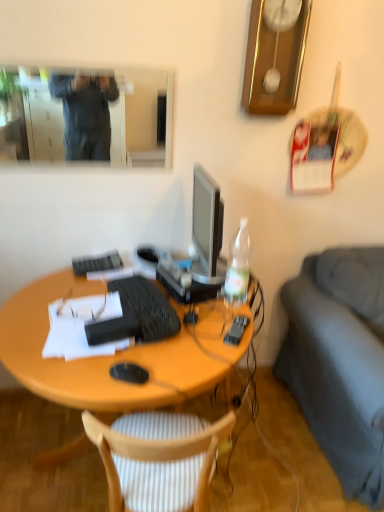
Locate an element on the screen. The height and width of the screenshot is (512, 384). free space in front of white paper at center is located at coordinates (79, 373).